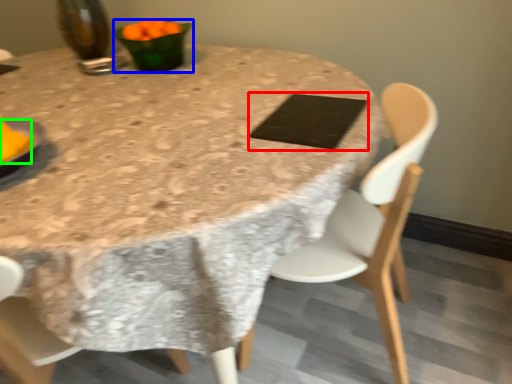
Question: Which object is the farthest from pad (highlighted by a red box)? Choose among these: tableware (highlighted by a blue box) or food (highlighted by a green box).

Choices:
 (A) tableware
 (B) food

Answer: (B)